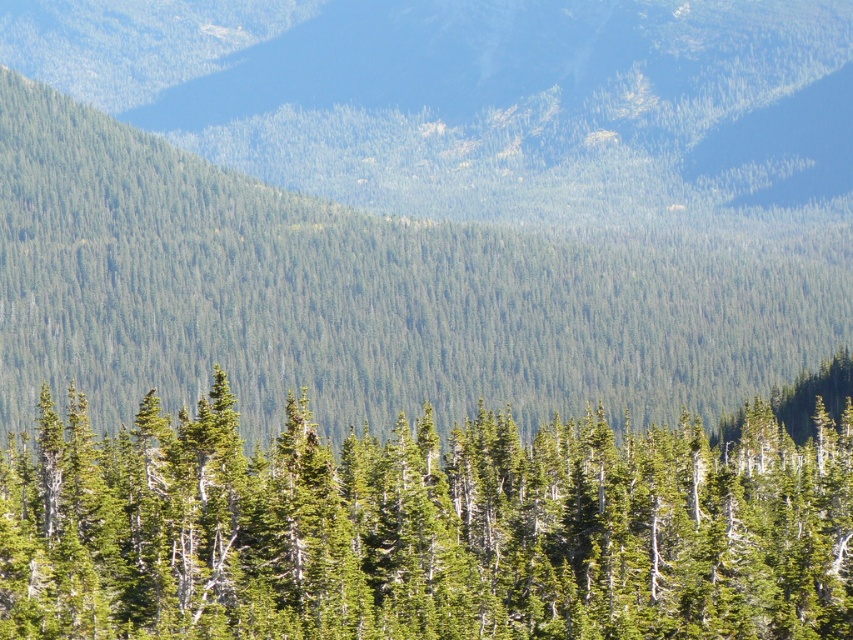
The image size is (853, 640). In order to click on green forested mountain at center in this screenshot , I will do `click(422, 202)`.

Who is shorter, green forested mountain at center or green matte tree at center?

green matte tree at center is shorter.

Which is in front, point (286, 298) or point (317, 465)?

Point (317, 465)

Locate an element on the screen. This screenshot has width=853, height=640. green forested mountain at center is located at coordinates (422, 202).